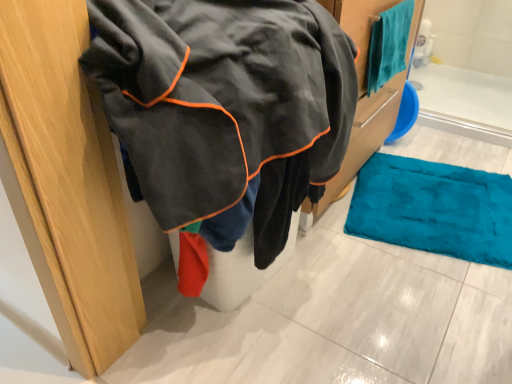
The height and width of the screenshot is (384, 512). What are the coordinates of `teal soft towel at upper right` in the screenshot? It's located at (388, 45).

Image resolution: width=512 pixels, height=384 pixels. Describe the element at coordinates (388, 45) in the screenshot. I see `teal soft towel at upper right` at that location.

What do you see at coordinates (224, 104) in the screenshot? The width and height of the screenshot is (512, 384). I see `velvet-like black jacket at left` at bounding box center [224, 104].

Image resolution: width=512 pixels, height=384 pixels. Identify the location of velvet-like black jacket at left. (224, 104).

I want to click on teal soft towel at upper right, so click(388, 45).

Considering the positions of objects velvet-like black jacket at left and teal soft towel at upper right in the image provided, who is more to the left, velvet-like black jacket at left or teal soft towel at upper right?

velvet-like black jacket at left.

Is the position of velvet-like black jacket at left more distant than that of teal soft towel at upper right?

No, velvet-like black jacket at left is closer to the camera.

Which is closer to the camera, (165, 7) or (394, 52)?

Point (165, 7).

From the image's perspective, is velvet-like black jacket at left under teal soft towel at upper right?

Correct, velvet-like black jacket at left appears lower than teal soft towel at upper right in the image.

From a real-world perspective, is velvet-like black jacket at left positioned under teal soft towel at upper right based on gravity?

Yes, from a real-world perspective, velvet-like black jacket at left is under teal soft towel at upper right.

Which of these two, velvet-like black jacket at left or teal soft towel at upper right, is wider?

Wider between the two is velvet-like black jacket at left.

Which of these two, velvet-like black jacket at left or teal soft towel at upper right, stands taller?

velvet-like black jacket at left is taller.

Which of these two, velvet-like black jacket at left or teal soft towel at upper right, is smaller?

With smaller size is teal soft towel at upper right.

Is teal soft towel at upper right completely or partially inside velvet-like black jacket at left?

That's incorrect, teal soft towel at upper right is not inside velvet-like black jacket at left.

Is velvet-like black jacket at left not near teal soft towel at upper right?

Actually, velvet-like black jacket at left and teal soft towel at upper right are a little close together.

Is velvet-like black jacket at left oriented towards teal soft towel at upper right?

No, velvet-like black jacket at left does not turn towards teal soft towel at upper right.

Find the location of a particular element. The width and height of the screenshot is (512, 384). jacket that is in front of the teal soft towel at upper right is located at coordinates (224, 104).

Considering the relative positions of teal soft towel at upper right and velvet-like black jacket at left in the image provided, is teal soft towel at upper right to the right of velvet-like black jacket at left from the viewer's perspective?

Yes, teal soft towel at upper right is to the right of velvet-like black jacket at left.

Considering the positions of objects teal soft towel at upper right and velvet-like black jacket at left in the image provided, who is behind, teal soft towel at upper right or velvet-like black jacket at left?

teal soft towel at upper right is further away from the camera.

Between point (407, 10) and point (247, 82), which one is positioned in front?

The point (247, 82) is closer to the camera.

From the image's perspective, which one is positioned higher, teal soft towel at upper right or velvet-like black jacket at left?

teal soft towel at upper right is shown above in the image.

From a real-world perspective, relative to velvet-like black jacket at left, is teal soft towel at upper right vertically above or below?

Clearly, from a real-world perspective, teal soft towel at upper right is above velvet-like black jacket at left.

Considering the relative sizes of teal soft towel at upper right and velvet-like black jacket at left in the image provided, is teal soft towel at upper right wider than velvet-like black jacket at left?

No, teal soft towel at upper right is not wider than velvet-like black jacket at left.

In terms of height, does teal soft towel at upper right look taller or shorter compared to velvet-like black jacket at left?

Clearly, teal soft towel at upper right is shorter compared to velvet-like black jacket at left.

Considering the sizes of teal soft towel at upper right and velvet-like black jacket at left in the image, is teal soft towel at upper right bigger or smaller than velvet-like black jacket at left?

teal soft towel at upper right is smaller than velvet-like black jacket at left.

Choose the correct answer: Is teal soft towel at upper right inside velvet-like black jacket at left or outside it?

teal soft towel at upper right is not inside velvet-like black jacket at left, it's outside.

In the scene shown: Are teal soft towel at upper right and velvet-like black jacket at left making contact?

teal soft towel at upper right and velvet-like black jacket at left are not in contact.

Is teal soft towel at upper right oriented away from velvet-like black jacket at left?

No, velvet-like black jacket at left is not at the back of teal soft towel at upper right.

Can you tell me how much teal soft towel at upper right and velvet-like black jacket at left differ in facing direction?

The angular difference between teal soft towel at upper right and velvet-like black jacket at left is 0.765 degrees.

How distant is teal soft towel at upper right from velvet-like black jacket at left?

They are 55.56 centimeters apart.

Identify the location of jacket beneath the teal soft towel at upper right (from a real-world perspective). This screenshot has width=512, height=384. (224, 104).

Image resolution: width=512 pixels, height=384 pixels. I want to click on towel above the velvet-like black jacket at left (from a real-world perspective), so click(x=388, y=45).

Locate an element on the screen. This screenshot has width=512, height=384. jacket in front of the teal soft towel at upper right is located at coordinates (224, 104).